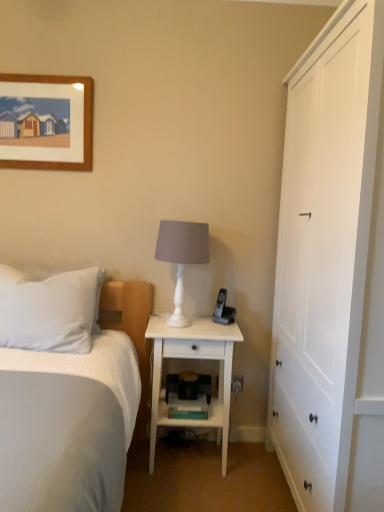
Locate an element on the screen. The width and height of the screenshot is (384, 512). vacant space underneath white matte lamp at center (from a real-world perspective) is located at coordinates [x=177, y=326].